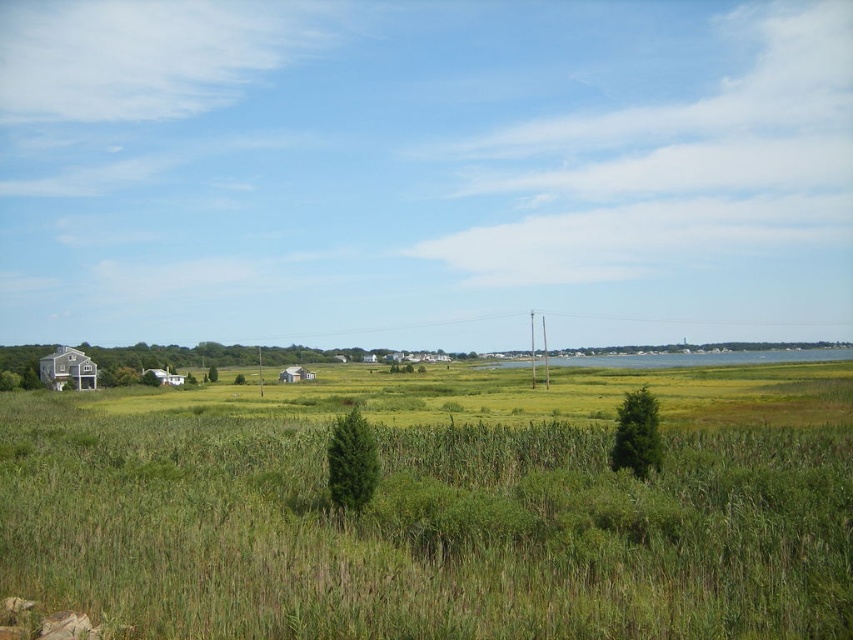
Question: Which point is farther to the camera?

Choices:
 (A) (78, 368)
 (B) (144, 369)

Answer: (B)

Question: Which is farther from the white matte house at lower left?

Choices:
 (A) wooden cabin at left
 (B) white corrugated metal hut at center

Answer: (B)

Question: Which of the following is the farthest from the observer?

Choices:
 (A) coord(164,380)
 (B) coord(279,374)

Answer: (B)

Question: Can you confirm if wooden cabin at left is bigger than white corrugated metal hut at center?

Choices:
 (A) no
 (B) yes

Answer: (A)

Question: Considering the relative positions of wooden cabin at left and white matte house at lower left in the image provided, where is wooden cabin at left located with respect to white matte house at lower left?

Choices:
 (A) below
 (B) above

Answer: (B)

Question: Can you confirm if wooden cabin at left is bigger than white corrugated metal hut at center?

Choices:
 (A) no
 (B) yes

Answer: (A)